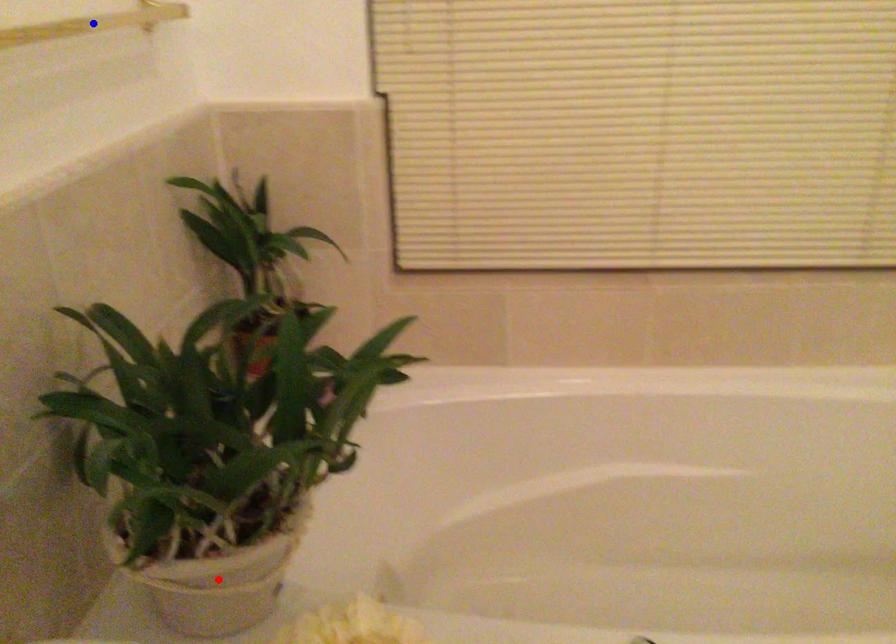
Question: In the image, two points are highlighted. Which point is nearer to the camera? Reply with the corresponding letter.

Choices:
 (A) blue point
 (B) red point

Answer: (B)